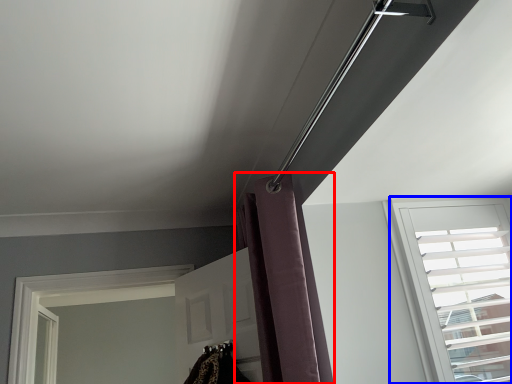
Question: Which point is further to the camera, shower curtain (highlighted by a red box) or window (highlighted by a blue box)?

Choices:
 (A) shower curtain
 (B) window

Answer: (B)